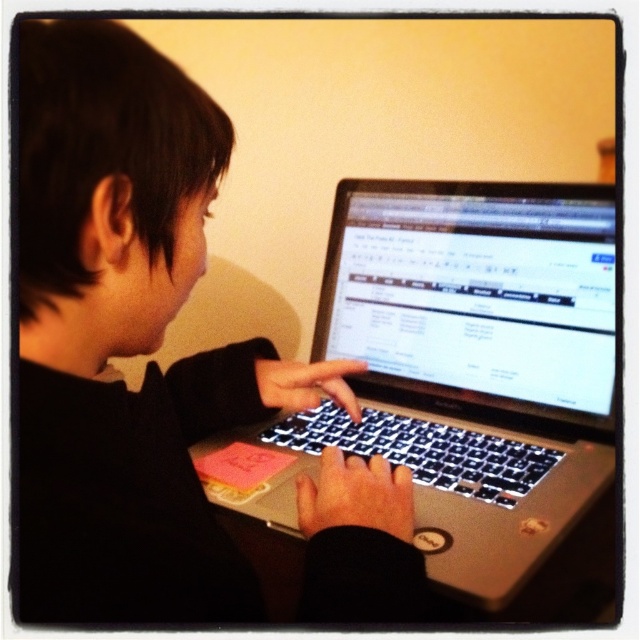
Question: Can you confirm if matte black laptop at center is positioned to the right of silver metallic laptop at center?

Choices:
 (A) no
 (B) yes

Answer: (A)

Question: In this image, where is matte black laptop at center located relative to silver metallic laptop at center?

Choices:
 (A) below
 (B) above

Answer: (B)

Question: Does matte black laptop at center appear under silver metallic laptop at center?

Choices:
 (A) yes
 (B) no

Answer: (B)